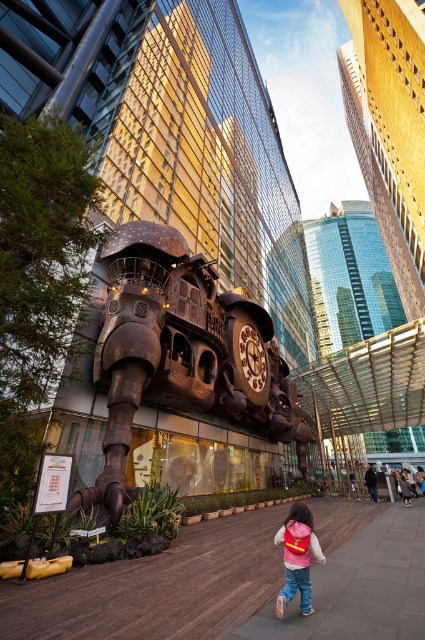
You are an artist planning to sketch the sculpture and its surroundings. You notice the shiny bronze clock at center and the pink fabric backpack at lower right. Which object should you focus on first if you want to draw the wider object?

The shiny bronze clock at center might be wider than pink fabric backpack at lower right, so you should focus on the shiny bronze clock at center first.

You are an artist planning to sketch the sculpture and its surroundings. You have a canvas that can only fit items up to the size of the pink fabric backpack at lower right. Can you include the shiny bronze clock at center in your sketch?

The shiny bronze clock at center is bigger than the pink fabric backpack at lower right, so it won not fit on the canvas.